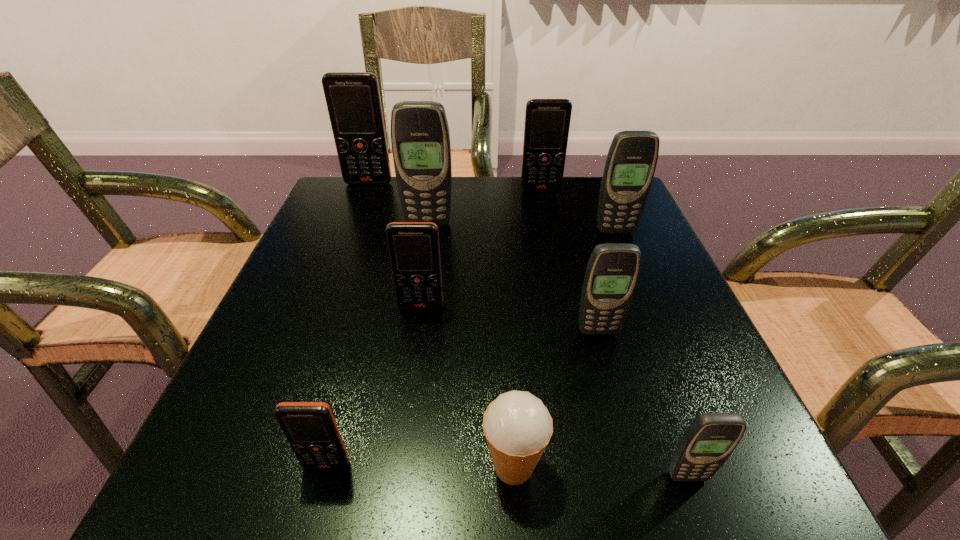
This screenshot has height=540, width=960. Find the location of `free space at the right edge of the desktop`. free space at the right edge of the desktop is located at coordinates (635, 399).

Identify the location of blank region between the biggest orange cellular telephone and the second farthest orange cellular telephone. (455, 186).

Identify the location of free spot between the second orange cellular telephone from right to left and the icecream. Image resolution: width=960 pixels, height=540 pixels. (468, 387).

At what (x,y) coordinates should I click in order to perform the action: click on free space between the third nearest orange cellular telephone and the nearest orange cellular telephone. Please return your answer as a coordinate pair (x, y). Looking at the image, I should click on (434, 327).

Where is `vacant point located between the fifth object from right to left and the third biggest orange cellular telephone`? vacant point located between the fifth object from right to left and the third biggest orange cellular telephone is located at coordinates (468, 387).

The width and height of the screenshot is (960, 540). I want to click on vacant space that's between the farthest orange cellular telephone and the rightmost orange cellular telephone, so click(x=455, y=186).

In order to click on free space between the nearest gray cellular telephone and the third farthest cellular telephone in this screenshot , I will do `click(558, 350)`.

Where is `unoccupied area between the second biggest orange cellular telephone and the farthest orange cellular telephone`? This screenshot has width=960, height=540. unoccupied area between the second biggest orange cellular telephone and the farthest orange cellular telephone is located at coordinates (455, 186).

In order to click on blank region between the third farthest gray cellular telephone and the smallest orange cellular telephone in this screenshot , I will do (x=463, y=398).

Locate which object is the closest to the third biggest gray cellular telephone. Please provide its 2D coordinates. Your answer should be formatted as a tuple, i.e. [(x, y)], where the tuple contains the x and y coordinates of a point satisfying the conditions above.

[(517, 426)]